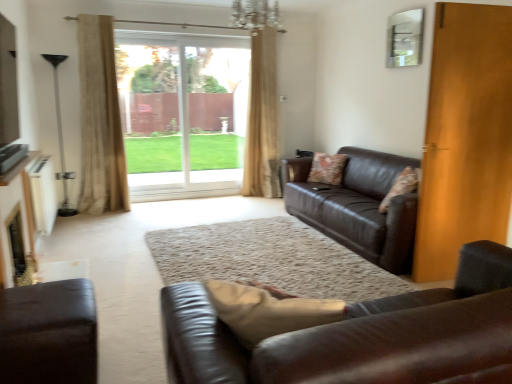
How much space does fluffy fabric pillow at right, which is counted as the 1th pillow, starting from the right, occupy vertically?

fluffy fabric pillow at right, which is counted as the 1th pillow, starting from the right, is 16.75 inches in height.

Describe the element at coordinates (401, 186) in the screenshot. I see `fluffy fabric pillow at right, placed as the first pillow when sorted from front to back` at that location.

What do you see at coordinates (48, 333) in the screenshot? The height and width of the screenshot is (384, 512). I see `matte brown leather couch at lower left, acting as the second studio couch starting from the back` at bounding box center [48, 333].

Describe the element at coordinates (358, 206) in the screenshot. I see `matte brown leather couch at right, the 1th studio couch from the back` at that location.

What are the coordinates of `matte brown leather couch at right, which ranks as the 3th studio couch in front-to-back order` in the screenshot? It's located at (358, 206).

The image size is (512, 384). I want to click on beige textured curtain at left, which is the 2th curtain from back to front, so click(x=100, y=120).

In order to click on floral fabric pillow at center, marked as the first pillow in a left-to-right arrangement in this screenshot , I will do coord(327,168).

Describe the element at coordinates (327, 168) in the screenshot. I see `floral fabric pillow at center, the 2th pillow viewed from the right` at that location.

This screenshot has height=384, width=512. I want to click on leather couch at center, marked as the 3th studio couch in a back-to-front arrangement, so click(x=360, y=336).

From the picture: Is the depth of fluffy fabric pillow at right, positioned as the second pillow in back-to-front order, less than that of beige textured curtain at left, which is the 2th curtain from back to front?

Yes.

Looking at this image, is fluffy fabric pillow at right, which is counted as the 1th pillow, starting from the right, located outside beige textured curtain at left, which is the first curtain in left-to-right order?

fluffy fabric pillow at right, which is counted as the 1th pillow, starting from the right, lies outside beige textured curtain at left, which is the first curtain in left-to-right order,'s area.

Based on their sizes in the image, would you say fluffy fabric pillow at right, the second pillow when ordered from left to right, is bigger or smaller than beige textured curtain at left, marked as the 2th curtain in a right-to-left arrangement?

fluffy fabric pillow at right, the second pillow when ordered from left to right, is smaller than beige textured curtain at left, marked as the 2th curtain in a right-to-left arrangement.

Can you tell me how much fluffy fabric pillow at right, the second pillow when ordered from left to right, and beige textured curtain at left, which is the 2th curtain from back to front, differ in facing direction?

126 degrees separate the facing orientations of fluffy fabric pillow at right, the second pillow when ordered from left to right, and beige textured curtain at left, which is the 2th curtain from back to front.

Based on the photo, is beige textured curtain at left, marked as the 2th curtain in a right-to-left arrangement, situated inside beige textured curtain at center, which appears as the 1th curtain when viewed from the right, or outside?

beige textured curtain at left, marked as the 2th curtain in a right-to-left arrangement, lies outside beige textured curtain at center, which appears as the 1th curtain when viewed from the right.

What's the angular difference between beige textured curtain at left, arranged as the 1th curtain when viewed from the front, and beige textured curtain at center, which appears as the 1th curtain when viewed from the right,'s facing directions?

The angle between the facing direction of beige textured curtain at left, arranged as the 1th curtain when viewed from the front, and the facing direction of beige textured curtain at center, which appears as the 1th curtain when viewed from the right, is 3.63 degrees.

Is beige textured curtain at left, which is the first curtain in left-to-right order, facing towards beige textured curtain at center, marked as the 1th curtain in a back-to-front arrangement?

No, beige textured curtain at left, which is the first curtain in left-to-right order, is not facing towards beige textured curtain at center, marked as the 1th curtain in a back-to-front arrangement.

From a real-world perspective, is beige textured curtain at left, arranged as the 1th curtain when viewed from the front, beneath beige textured curtain at center, which appears as the 1th curtain when viewed from the right?

No, from a real-world perspective, beige textured curtain at left, arranged as the 1th curtain when viewed from the front, is not below beige textured curtain at center, which appears as the 1th curtain when viewed from the right.

Considering the sizes of objects floral fabric pillow at center, the 2th pillow viewed from the right, and transparent glass door at center in the image provided, who is shorter, floral fabric pillow at center, the 2th pillow viewed from the right, or transparent glass door at center?

With less height is floral fabric pillow at center, the 2th pillow viewed from the right.

Does floral fabric pillow at center, which is counted as the second pillow, starting from the front, have a greater width compared to transparent glass door at center?

Yes, floral fabric pillow at center, which is counted as the second pillow, starting from the front, is wider than transparent glass door at center.

Which object is positioned more to the left, floral fabric pillow at center, the 2th pillow viewed from the right, or transparent glass door at center?

Positioned to the left is transparent glass door at center.

Based on the photo, does floral fabric pillow at center, the 2th pillow viewed from the right, turn towards transparent glass door at center?

No.

Consider the image. Would you say transparent glass door at center is to the left or to the right of wooden door at right in the picture?

transparent glass door at center is to the left of wooden door at right.

From the image's perspective, is transparent glass door at center located beneath wooden door at right?

No, from the image's perspective, transparent glass door at center is not beneath wooden door at right.

In the scene shown: Choose the correct answer: Is transparent glass door at center inside wooden door at right or outside it?

transparent glass door at center exists outside the volume of wooden door at right.

Does transparent glass door at center have a lesser height compared to wooden door at right?

Indeed, transparent glass door at center has a lesser height compared to wooden door at right.

Which object is closer to the camera, crystal glass chandelier at upper center or transparent glass door at center?

Positioned in front is crystal glass chandelier at upper center.

From a real-world perspective, is crystal glass chandelier at upper center below transparent glass door at center?

No.

Considering the sizes of crystal glass chandelier at upper center and transparent glass door at center in the image, is crystal glass chandelier at upper center taller or shorter than transparent glass door at center?

Clearly, crystal glass chandelier at upper center is shorter compared to transparent glass door at center.

How much distance is there between crystal glass chandelier at upper center and transparent glass door at center?

crystal glass chandelier at upper center is 3.88 feet from transparent glass door at center.

From a real-world perspective, starting from the beige textured curtain at left, which is the 2th curtain from back to front, which studio couch is the 2nd one below it? Please provide its 2D coordinates.

[(358, 206)]

Is beige textured curtain at left, marked as the 2th curtain in a right-to-left arrangement, far away from matte brown leather couch at right, which ranks as the 3th studio couch in front-to-back order?

That's right, there is a large distance between beige textured curtain at left, marked as the 2th curtain in a right-to-left arrangement, and matte brown leather couch at right, which ranks as the 3th studio couch in front-to-back order.

Considering the points (111, 132) and (380, 184), which point is in front, point (111, 132) or point (380, 184)?

Positioned in front is point (380, 184).

Can matte brown leather couch at right, which ranks as the 3th studio couch in front-to-back order, be found inside beige textured curtain at left, which is the first curtain in left-to-right order?

No, matte brown leather couch at right, which ranks as the 3th studio couch in front-to-back order, is located outside of beige textured curtain at left, which is the first curtain in left-to-right order.

Can we say matte brown leather couch at lower left, acting as the second studio couch starting from the back, lies outside floral fabric pillow at center, marked as the first pillow in a left-to-right arrangement?

Absolutely, matte brown leather couch at lower left, acting as the second studio couch starting from the back, is external to floral fabric pillow at center, marked as the first pillow in a left-to-right arrangement.

Which is nearer, (72, 325) or (311, 180)?

Point (72, 325) is positioned closer to the camera compared to point (311, 180).

From a real-world perspective, is matte brown leather couch at lower left, the 2th studio couch from the front, physically located above or below floral fabric pillow at center, marked as the first pillow in a left-to-right arrangement?

matte brown leather couch at lower left, the 2th studio couch from the front, is below floral fabric pillow at center, marked as the first pillow in a left-to-right arrangement.

Locate an element on the screen. the 2nd curtain located above the fluffy fabric pillow at right, positioned as the second pillow in back-to-front order (from a real-world perspective) is located at coordinates (100, 120).

Find the location of a particular element. This screenshot has height=384, width=512. curtain on the right of beige textured curtain at left, arranged as the 1th curtain when viewed from the front is located at coordinates (262, 119).

From the image, which object appears to be farther from beige textured curtain at center, which appears as the second curtain when viewed from the left, transparent glass door at center or floral fabric pillow at center, which ranks as the first pillow in back-to-front order?

floral fabric pillow at center, which ranks as the first pillow in back-to-front order.

Estimate the real-world distances between objects in this image. Which object is closer to wooden door at right, floral fabric pillow at center, the 2th pillow viewed from the right, or leather couch at center, marked as the 3th studio couch in a back-to-front arrangement?

The object closer to wooden door at right is floral fabric pillow at center, the 2th pillow viewed from the right.

Looking at the image, which one is located further to matte brown leather couch at lower left, the 2th studio couch from the front, matte brown leather couch at right, the 1th studio couch from the back, or wooden door at right?

wooden door at right is further to matte brown leather couch at lower left, the 2th studio couch from the front.

Estimate the real-world distances between objects in this image. Which object is further from beige textured curtain at center, marked as the 1th curtain in a back-to-front arrangement, wooden door at right or matte brown leather couch at right, which ranks as the 3th studio couch in front-to-back order?

wooden door at right is positioned further to the anchor beige textured curtain at center, marked as the 1th curtain in a back-to-front arrangement.

Estimate the real-world distances between objects in this image. Which object is further from transparent glass door at center, crystal glass chandelier at upper center or beige textured curtain at left, which is the 2th curtain from back to front?

crystal glass chandelier at upper center.

From the image, which object appears to be nearer to crystal glass chandelier at upper center, wooden door at right or leather couch at center, marked as the 1th studio couch in a front-to-back arrangement?

wooden door at right lies closer to crystal glass chandelier at upper center than the other object.

Which object lies nearer to the anchor point wooden door at right, fluffy fabric pillow at right, which is counted as the 1th pillow, starting from the right, or floral fabric pillow at center, the 2th pillow viewed from the right?

Among the two, fluffy fabric pillow at right, which is counted as the 1th pillow, starting from the right, is located nearer to wooden door at right.

When comparing their distances from leather couch at center, marked as the 3th studio couch in a back-to-front arrangement, does beige textured curtain at left, which is the first curtain in left-to-right order, or transparent glass door at center seem closer?

beige textured curtain at left, which is the first curtain in left-to-right order.

Image resolution: width=512 pixels, height=384 pixels. Identify the location of curtain between matte brown leather couch at lower left, the 2th studio couch from the front, and floral fabric pillow at center, the 2th pillow viewed from the right, in the front-back direction. click(100, 120).

This screenshot has width=512, height=384. Identify the location of door located between leather couch at center, marked as the 1th studio couch in a front-to-back arrangement, and beige textured curtain at center, the second curtain positioned from the front, in the depth direction. (465, 137).

This screenshot has width=512, height=384. What are the coordinates of `chandelier between leather couch at center, marked as the 1th studio couch in a front-to-back arrangement, and floral fabric pillow at center, the 2th pillow viewed from the right, from front to back` in the screenshot? It's located at (256, 15).

This screenshot has width=512, height=384. Identify the location of studio couch positioned between wooden door at right and beige textured curtain at center, marked as the 1th curtain in a back-to-front arrangement, from near to far. (358, 206).